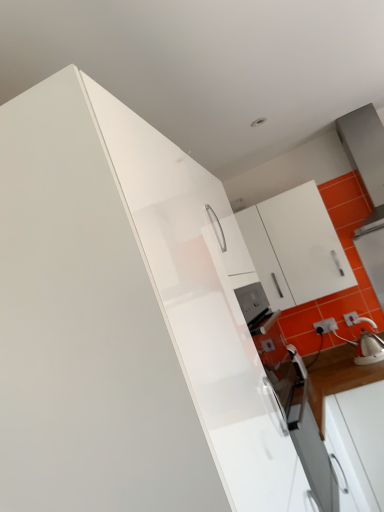
Find the location of a particular element. white glossy cabinet at upper right, marked as the first cabinetry in a right-to-left arrangement is located at coordinates (295, 247).

Where is `white glossy cabinet at upper left, marked as the first cabinetry in a left-to-right arrangement`? This screenshot has width=384, height=512. white glossy cabinet at upper left, marked as the first cabinetry in a left-to-right arrangement is located at coordinates (119, 316).

Who is taller, white plastic electric outlet at lower right or white glossy kettle at right?

Standing taller between the two is white glossy kettle at right.

Between white plastic electric outlet at lower right and white glossy kettle at right, which one appears on the left side from the viewer's perspective?

Positioned to the left is white plastic electric outlet at lower right.

Between white plastic electric outlet at lower right and white glossy kettle at right, which one has smaller width?

white plastic electric outlet at lower right is thinner.

From the image's perspective, does white plastic electric outlet at lower right appear higher than white glossy kettle at right?

Actually, white plastic electric outlet at lower right appears below white glossy kettle at right in the image.

Does white glossy cabinet at upper right, the 1th cabinetry positioned from the back, have a lesser height compared to white glossy cabinet at upper left, the 2th cabinetry positioned from the right?

Yes.

From the image's perspective, which is above, white glossy cabinet at upper right, the 1th cabinetry positioned from the back, or white glossy cabinet at upper left, marked as the first cabinetry in a left-to-right arrangement?

white glossy cabinet at upper right, the 1th cabinetry positioned from the back, is shown above in the image.

Which is more to the left, white glossy cabinet at upper right, the second cabinetry positioned from the left, or white glossy cabinet at upper left, which is the second cabinetry in back-to-front order?

white glossy cabinet at upper left, which is the second cabinetry in back-to-front order.

From a real-world perspective, is white plastic electric outlet at lower right below white glossy cabinet at upper right, marked as the first cabinetry in a right-to-left arrangement?

Yes, from a real-world perspective, white plastic electric outlet at lower right is under white glossy cabinet at upper right, marked as the first cabinetry in a right-to-left arrangement.

Are white plastic electric outlet at lower right and white glossy cabinet at upper right, arranged as the second cabinetry when viewed from the front, beside each other?

white plastic electric outlet at lower right and white glossy cabinet at upper right, arranged as the second cabinetry when viewed from the front, are clearly separated.

Could you tell me if white plastic electric outlet at lower right is facing white glossy cabinet at upper right, the second cabinetry positioned from the left?

No, white plastic electric outlet at lower right is not aimed at white glossy cabinet at upper right, the second cabinetry positioned from the left.

Is point (380, 215) closer to viewer compared to point (313, 218)?

No, (380, 215) is behind (313, 218).

From the image's perspective, between white glossy kettle at right and white glossy cabinet at upper right, arranged as the second cabinetry when viewed from the front, who is located below?

white glossy kettle at right, from the image's perspective.

Is white glossy kettle at right outside of white glossy cabinet at upper right, the second cabinetry positioned from the left?

white glossy kettle at right lies outside white glossy cabinet at upper right, the second cabinetry positioned from the left,'s area.

From the image's perspective, which one is positioned lower, white glossy kettle at right or white plastic electric outlet at lower right?

white plastic electric outlet at lower right.

Consider the image. Is white glossy kettle at right wider than white plastic electric outlet at lower right?

Yes.

Can we say white plastic electric outlet at lower right lies outside white glossy cabinet at upper left, acting as the 1th cabinetry starting from the front?

Yes, white plastic electric outlet at lower right is located beyond the bounds of white glossy cabinet at upper left, acting as the 1th cabinetry starting from the front.

Who is taller, white plastic electric outlet at lower right or white glossy cabinet at upper left, marked as the first cabinetry in a left-to-right arrangement?

white glossy cabinet at upper left, marked as the first cabinetry in a left-to-right arrangement, is taller.

From a real-world perspective, does white plastic electric outlet at lower right sit lower than white glossy cabinet at upper left, acting as the 1th cabinetry starting from the front?

Indeed, from a real-world perspective, white plastic electric outlet at lower right is positioned beneath white glossy cabinet at upper left, acting as the 1th cabinetry starting from the front.

From the picture: Is white glossy cabinet at upper left, acting as the 1th cabinetry starting from the front, inside the boundaries of white plastic electric outlet at lower right, or outside?

white glossy cabinet at upper left, acting as the 1th cabinetry starting from the front, cannot be found inside white plastic electric outlet at lower right.

Consider the image. Is white glossy cabinet at upper left, acting as the 1th cabinetry starting from the front, positioned with its back to white plastic electric outlet at lower right?

No, white glossy cabinet at upper left, acting as the 1th cabinetry starting from the front, is not facing away from white plastic electric outlet at lower right.

How many degrees apart are the facing directions of white glossy cabinet at upper left, which is the second cabinetry in back-to-front order, and white plastic electric outlet at lower right?

90 degrees.

Between white glossy cabinet at upper left, which is the second cabinetry in back-to-front order, and white plastic electric outlet at lower right, which one is positioned in front?

white glossy cabinet at upper left, which is the second cabinetry in back-to-front order.

Image resolution: width=384 pixels, height=512 pixels. Find the location of `electric outlet below the white glossy kettle at right (from the image's perspective)`. electric outlet below the white glossy kettle at right (from the image's perspective) is located at coordinates (325, 326).

Find the location of a particular element. The image size is (384, 512). cabinetry that is above the white glossy cabinet at upper left, the 2th cabinetry positioned from the right (from a real-world perspective) is located at coordinates (295, 247).

From the image, which object appears to be farther from white glossy cabinet at upper left, acting as the 1th cabinetry starting from the front, white glossy kettle at right or white glossy cabinet at upper right, the second cabinetry positioned from the left?

The object further to white glossy cabinet at upper left, acting as the 1th cabinetry starting from the front, is white glossy kettle at right.

Considering their positions, is white glossy cabinet at upper left, which is the second cabinetry in back-to-front order, positioned closer to white plastic electric outlet at lower right than white glossy kettle at right?

The object closer to white plastic electric outlet at lower right is white glossy kettle at right.

Looking at the image, which one is located closer to white glossy cabinet at upper right, arranged as the second cabinetry when viewed from the front, white plastic electric outlet at lower right or white glossy kettle at right?

white glossy kettle at right lies closer to white glossy cabinet at upper right, arranged as the second cabinetry when viewed from the front, than the other object.

Based on their spatial positions, is white glossy kettle at right or white glossy cabinet at upper left, acting as the 1th cabinetry starting from the front, closer to white plastic electric outlet at lower right?

white glossy kettle at right is closer to white plastic electric outlet at lower right.

Estimate the real-world distances between objects in this image. Which object is closer to white plastic electric outlet at lower right, white glossy cabinet at upper right, marked as the first cabinetry in a right-to-left arrangement, or white glossy kettle at right?

The object closer to white plastic electric outlet at lower right is white glossy kettle at right.

From the image, which object appears to be nearer to white glossy cabinet at upper left, marked as the first cabinetry in a left-to-right arrangement, white glossy cabinet at upper right, the 1th cabinetry positioned from the back, or white plastic electric outlet at lower right?

white glossy cabinet at upper right, the 1th cabinetry positioned from the back, is positioned closer to the anchor white glossy cabinet at upper left, marked as the first cabinetry in a left-to-right arrangement.

Looking at the image, which one is located further to white glossy kettle at right, white glossy cabinet at upper right, marked as the first cabinetry in a right-to-left arrangement, or white plastic electric outlet at lower right?

white plastic electric outlet at lower right is positioned further to the anchor white glossy kettle at right.

Which object lies nearer to the anchor point white glossy kettle at right, white plastic electric outlet at lower right or white glossy cabinet at upper right, the second cabinetry positioned from the left?

The object closer to white glossy kettle at right is white glossy cabinet at upper right, the second cabinetry positioned from the left.

Identify the location of cabinetry positioned between white glossy cabinet at upper left, the 2th cabinetry positioned from the right, and white plastic electric outlet at lower right from near to far. The height and width of the screenshot is (512, 384). (295, 247).

You are a GUI agent. You are given a task and a screenshot of the screen. Output one action in this format:
    pyautogui.click(x=<x>, y=<y>)
    Task: Click on the cabinetry between white glossy cabinet at upper left, which is the second cabinetry in back-to-front order, and white glossy kettle at right in the front-back direction
    Image resolution: width=384 pixels, height=512 pixels.
    Given the screenshot: What is the action you would take?
    pyautogui.click(x=295, y=247)

You are a GUI agent. You are given a task and a screenshot of the screen. Output one action in this format:
    pyautogui.click(x=<x>, y=<y>)
    Task: Click on the electric outlet between white glossy cabinet at upper right, the second cabinetry positioned from the left, and white glossy kettle at right from left to right
    This screenshot has width=384, height=512.
    Given the screenshot: What is the action you would take?
    pyautogui.click(x=325, y=326)

In order to click on appliance between white glossy cabinet at upper left, acting as the 1th cabinetry starting from the front, and white plastic electric outlet at lower right from front to back in this screenshot , I will do `click(372, 249)`.